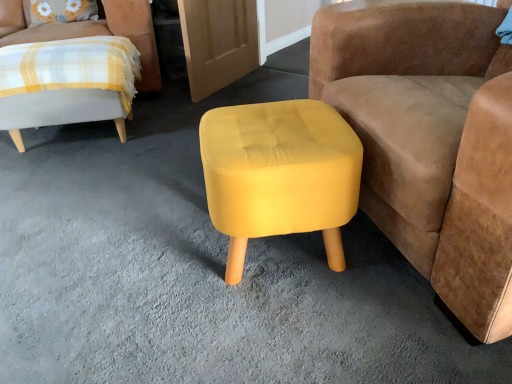
Question: Is plaid fabric chair at left, which is the 1th chair from back to front, aimed at velvet mustard stool at center, arranged as the 1th chair when viewed from the right?

Choices:
 (A) no
 (B) yes

Answer: (A)

Question: Is plaid fabric chair at left, which ranks as the second chair in front-to-back order, to the right of velvet mustard stool at center, which is counted as the 2th chair, starting from the left, from the viewer's perspective?

Choices:
 (A) yes
 (B) no

Answer: (B)

Question: From a real-world perspective, is plaid fabric chair at left, which is the 1th chair from back to front, beneath velvet mustard stool at center, arranged as the 1th chair when viewed from the right?

Choices:
 (A) no
 (B) yes

Answer: (B)

Question: Is plaid fabric chair at left, which is the 1th chair from back to front, positioned beyond the bounds of velvet mustard stool at center, which is counted as the 2th chair, starting from the left?

Choices:
 (A) yes
 (B) no

Answer: (A)

Question: Is the position of plaid fabric chair at left, the 1th chair positioned from the left, more distant than that of velvet mustard stool at center, arranged as the 1th chair when viewed from the right?

Choices:
 (A) yes
 (B) no

Answer: (A)

Question: From a real-world perspective, is plaid fabric chair at left, which is the 1th chair from back to front, located higher than velvet mustard stool at center, which is counted as the 2th chair, starting from the left?

Choices:
 (A) yes
 (B) no

Answer: (B)

Question: Is velvet mustard stool at center, which is counted as the 1th chair, starting from the front, aimed at plaid fabric chair at left, which ranks as the second chair in front-to-back order?

Choices:
 (A) yes
 (B) no

Answer: (B)

Question: Can you confirm if velvet mustard stool at center, arranged as the 1th chair when viewed from the right, is wider than plaid fabric chair at left, the 1th chair positioned from the left?

Choices:
 (A) no
 (B) yes

Answer: (A)

Question: Is velvet mustard stool at center, arranged as the 1th chair when viewed from the right, behind plaid fabric chair at left, marked as the second chair in a right-to-left arrangement?

Choices:
 (A) yes
 (B) no

Answer: (B)

Question: Can you confirm if velvet mustard stool at center, the second chair in the back-to-front sequence, is smaller than plaid fabric chair at left, which ranks as the second chair in front-to-back order?

Choices:
 (A) no
 (B) yes

Answer: (A)

Question: From the image's perspective, does velvet mustard stool at center, which is counted as the 2th chair, starting from the left, appear lower than plaid fabric chair at left, the 1th chair positioned from the left?

Choices:
 (A) no
 (B) yes

Answer: (B)

Question: Does yellow fabric stool at center touch plaid fabric chair at left, marked as the second chair in a right-to-left arrangement?

Choices:
 (A) no
 (B) yes

Answer: (A)